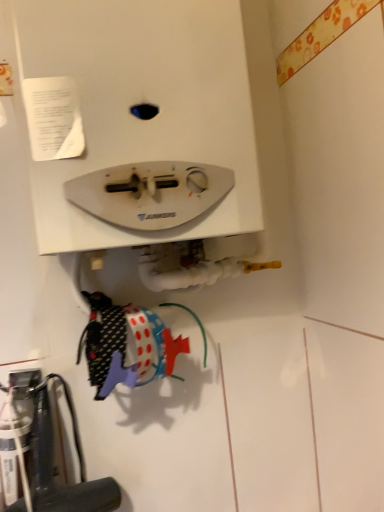
What do you see at coordinates (143, 102) in the screenshot?
I see `white plastic boiler at upper center` at bounding box center [143, 102].

In order to click on white plastic boiler at upper center in this screenshot , I will do `click(143, 102)`.

At what (x,y) coordinates should I click in order to perform the action: click on white plastic boiler at upper center. Please return your answer as a coordinate pair (x, y). Image resolution: width=384 pixels, height=512 pixels. Looking at the image, I should click on (143, 102).